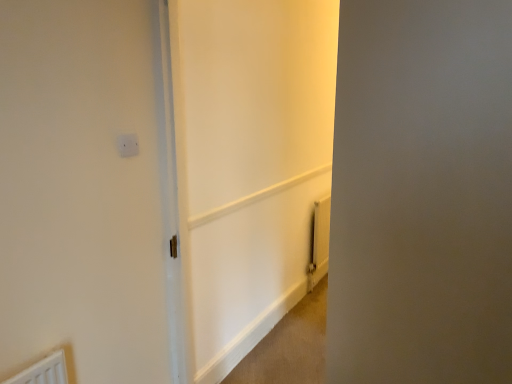
Question: Considering the positions of yellow metallic radiator at lower right and white glossy door at center, which is the 1th screen door in left-to-right order, in the image, is yellow metallic radiator at lower right taller or shorter than white glossy door at center, which is the 1th screen door in left-to-right order,?

Choices:
 (A) tall
 (B) short

Answer: (B)

Question: Is point (318, 203) closer or farther from the camera than point (269, 231)?

Choices:
 (A) farther
 (B) closer

Answer: (A)

Question: Based on their relative distances, which object is nearer to the white matte screen door at right, the 2th screen door from the left?

Choices:
 (A) yellow metallic radiator at lower right
 (B) white plastic electric outlet at upper center
 (C) white glossy door at center, placed as the 2th screen door when sorted from right to left

Answer: (B)

Question: Estimate the real-world distances between objects in this image. Which object is farther from the white matte screen door at right, the 1th screen door positioned from the right?

Choices:
 (A) white glossy door at center, which is the 1th screen door in left-to-right order
 (B) white plastic electric outlet at upper center
 (C) yellow metallic radiator at lower right

Answer: (C)